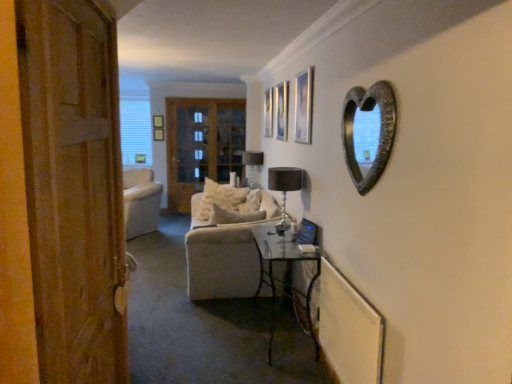
Question: From a real-world perspective, is metallic silver picture frame at upper center, which is the second picture frame from left to right, positioned above or below clear glass door at center?

Choices:
 (A) below
 (B) above

Answer: (B)

Question: Looking at their shapes, would you say metallic silver picture frame at upper center, the second picture frame viewed from the back, is wider or thinner than clear glass door at center?

Choices:
 (A) wide
 (B) thin

Answer: (A)

Question: Which of these objects is positioned farthest from the metallic silver picture frame at upper center, the second picture frame viewed from the back?

Choices:
 (A) clear glass door at center
 (B) rustic wood heart-shaped mirror at upper right
 (C) metallic glass table at lower center
 (D) black glass lamp at center, which appears as the 1th lamp when viewed from the right
 (E) wooden door at left

Answer: (E)

Question: Considering the real-world distances, which object is closest to the clear glass door at center?

Choices:
 (A) metallic glass table at lower center
 (B) matte wooden picture frame at upper center, the third picture frame when ordered from left to right
 (C) rustic wood heart-shaped mirror at upper right
 (D) matte wooden picture frame at upper center, positioned as the third picture frame in front-to-back order
 (E) metallic silver picture frame at upper center, which is the second picture frame in front-to-back order

Answer: (D)